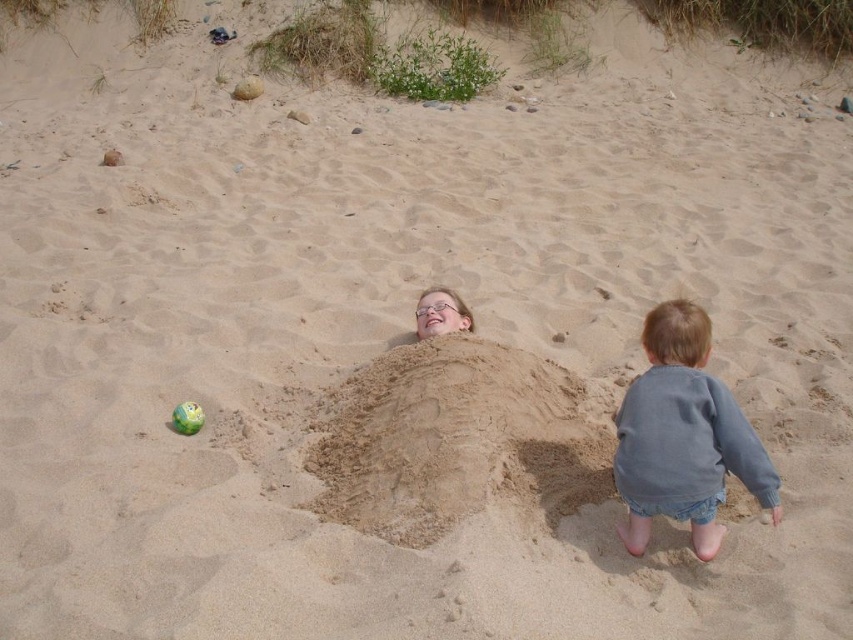
Is denim shorts at lower right below green rubber ball at center?

Actually, denim shorts at lower right is above green rubber ball at center.

At what (x,y) coordinates should I click in order to perform the action: click on denim shorts at lower right. Please return your answer as a coordinate pair (x, y). Looking at the image, I should click on (683, 435).

The image size is (853, 640). What are the coordinates of `denim shorts at lower right` in the screenshot? It's located at (683, 435).

Does beige sand mound at center have a greater height compared to green rubber ball at center?

Yes, beige sand mound at center is taller than green rubber ball at center.

Is beige sand mound at center further to camera compared to green rubber ball at center?

No, beige sand mound at center is closer to the viewer.

Locate an element on the screen. beige sand mound at center is located at coordinates (456, 438).

Which is behind, point (544, 493) or point (672, 513)?

The point (544, 493) is more distant.

Is point (422, 344) closer to viewer compared to point (688, 499)?

No, (422, 344) is behind (688, 499).

Where is `beige sand mound at center`? The height and width of the screenshot is (640, 853). beige sand mound at center is located at coordinates (456, 438).